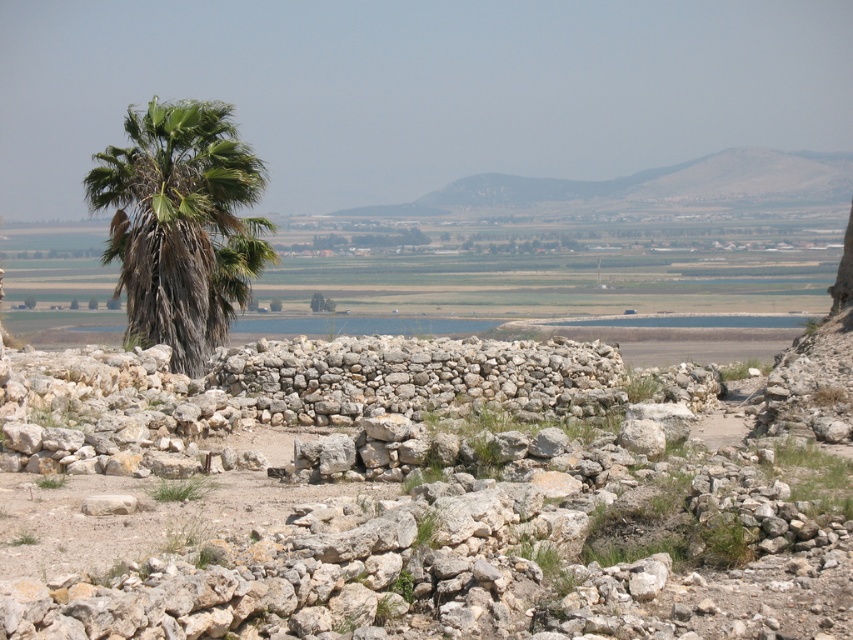
You are a hiker who wants to take a photo of both the gray stone wall at center and the green leafy tree at center. Which object should you focus on first to ensure both are in the frame?

The gray stone wall at center is below the green leafy tree at center, so you should focus on the green leafy tree at center first to ensure both are in the frame.

You are standing at the center of the rocky terrain and want to walk towards the green leafy palm at left. Which direction should you head?

The green leafy palm at left is located at point (180, 225), which is to the left side of the image. Since you are at the center, you should head towards the left direction to reach it.

You are planning to build a small garden between the gray stone wall at center and the green leafy palm at left. Which object has a narrower width to allow more space for plants?

The gray stone wall at center is thinner than the green leafy palm at left, so it has a narrower width, allowing more space for plants between them.